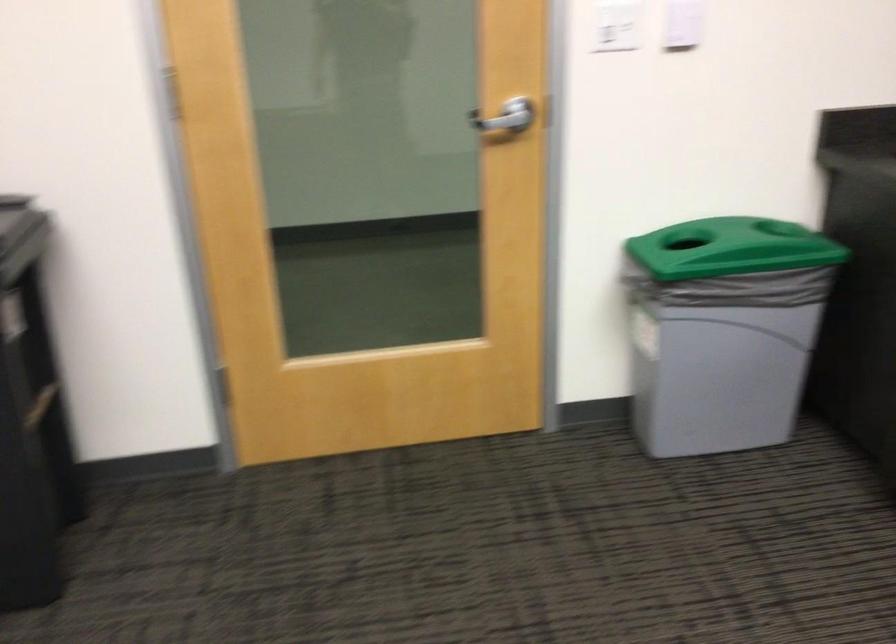
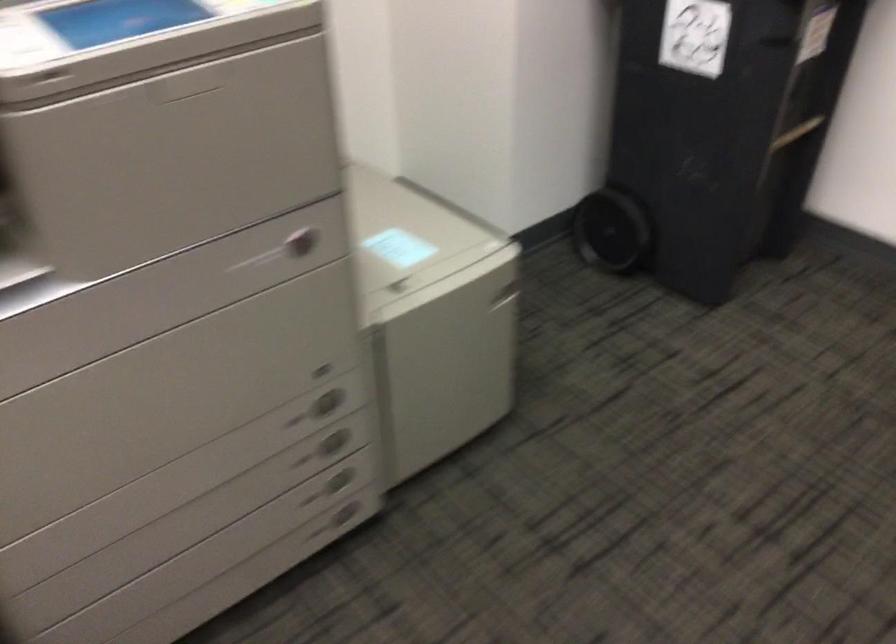
The images are taken continuously from a first-person perspective. In which direction is your viewpoint rotating?

The camera's rotation is toward left-down.